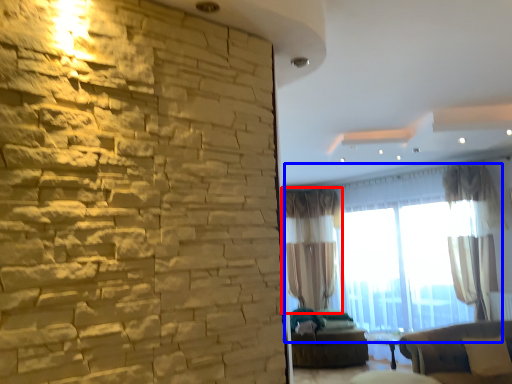
Question: Which object is closer to the camera taking this photo, curtain (highlighted by a red box) or window (highlighted by a blue box)?

Choices:
 (A) curtain
 (B) window

Answer: (B)